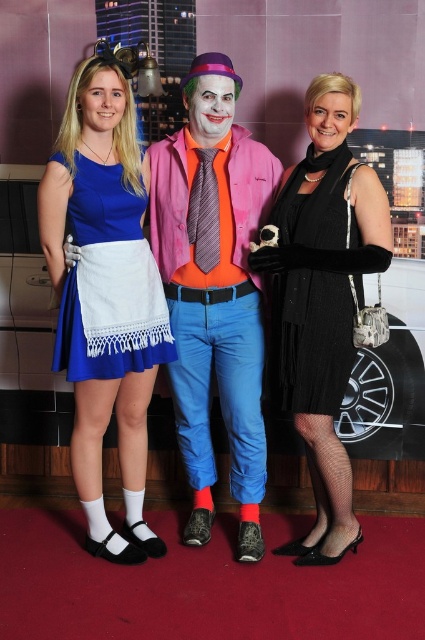
You are a photographer at this themed event. You need to arrange the blue cotton dress at center and the black knitted dress at right so that the shorter one is on the left. Is the current arrangement correct?

The blue cotton dress at center has a lesser height compared to the black knitted dress at right. Therefore, the current arrangement with the blue cotton dress at center and the black knitted dress at right already places the shorter one on the left, so it is correct.

You are a photographer trying to focus on the black textured dress at center. However, the pink fabric clown costume at center is blocking your view. Can you adjust your camera angle to see the dress without moving any of the people?

The pink fabric clown costume at center is positioned over the black textured dress at center, so adjusting the camera angle might allow you to see the dress beneath if there are gaps or by tilting the camera slightly.